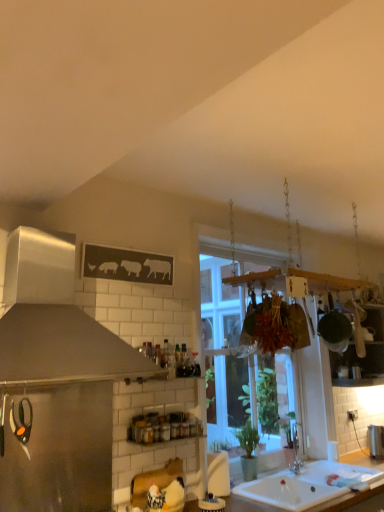
Question: Is clear glass window at center inside or outside of brushed metal trash can at lower right, arranged as the 1th appliance when viewed from the back?

Choices:
 (A) outside
 (B) inside

Answer: (A)

Question: Relative to brushed metal trash can at lower right, positioned as the 3th appliance in top-to-bottom order, is clear glass window at center in front or behind?

Choices:
 (A) behind
 (B) front

Answer: (B)

Question: Which object is the closest to the brushed metal trash can at lower right, acting as the 3th appliance starting from the left?

Choices:
 (A) white glossy countertop at lower center
 (B) white ceramic sink at lower center
 (C) matte black scissors at left, which ranks as the third appliance in right-to-left order
 (D) stainless steel refrigerator at lower left, which is the second appliance in left-to-right order
 (E) clear glass window at center

Answer: (A)

Question: Which object is the farthest from the matte black scissors at left, which ranks as the first appliance in left-to-right order?

Choices:
 (A) brushed metal trash can at lower right, arranged as the 1th appliance when viewed from the back
 (B) stainless steel refrigerator at lower left, which ranks as the 1th appliance in front-to-back order
 (C) white glossy countertop at lower center
 (D) clear glass window at center
 (E) white ceramic sink at lower center

Answer: (A)